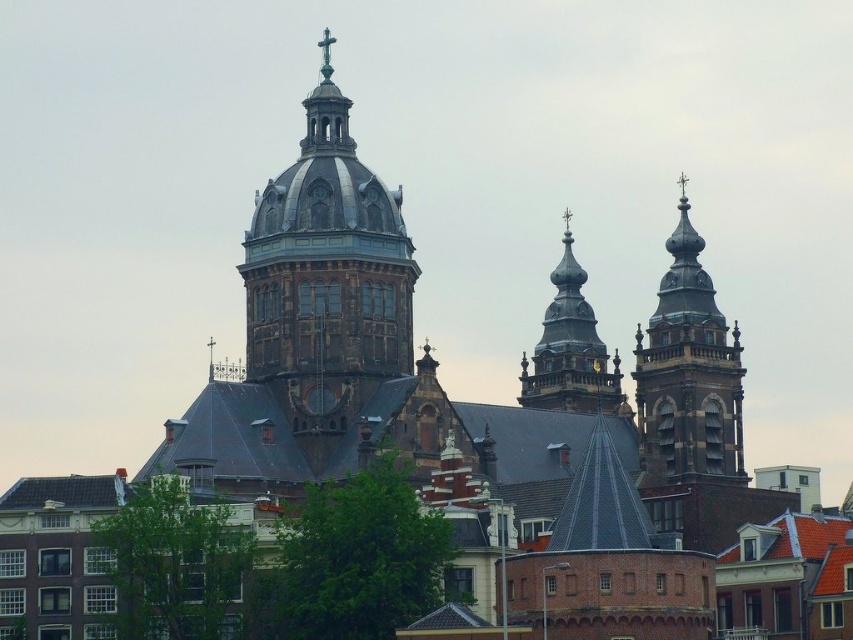
Can you confirm if dark brown stone tower at center is taller than polished stone spire at center?

Correct, dark brown stone tower at center is much taller as polished stone spire at center.

Can you confirm if dark brown stone tower at center is wider than polished stone spire at center?

Yes, dark brown stone tower at center is wider than polished stone spire at center.

Between point (381, 300) and point (554, 381), which one is positioned in front?

Positioned in front is point (381, 300).

This screenshot has width=853, height=640. I want to click on dark brown stone tower at center, so click(328, 278).

Does dark brown stone tower at center appear under polished stone spire at upper right?

No.

Does dark brown stone tower at center appear on the right side of polished stone spire at upper right?

No, dark brown stone tower at center is not to the right of polished stone spire at upper right.

Find the location of a particular element. dark brown stone tower at center is located at coordinates click(328, 278).

Consider the image. Which is below, polished stone spire at upper right or polished stone spire at center?

Positioned lower is polished stone spire at upper right.

Which is behind, point (732, 353) or point (541, 358)?

Point (541, 358)

Where is `polished stone spire at upper right`? The image size is (853, 640). polished stone spire at upper right is located at coordinates (688, 371).